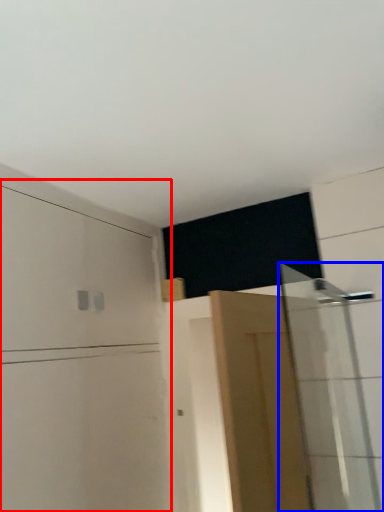
Question: Which point is closer to the camera, dresser (highlighted by a red box) or shower door (highlighted by a blue box)?

Choices:
 (A) dresser
 (B) shower door

Answer: (A)